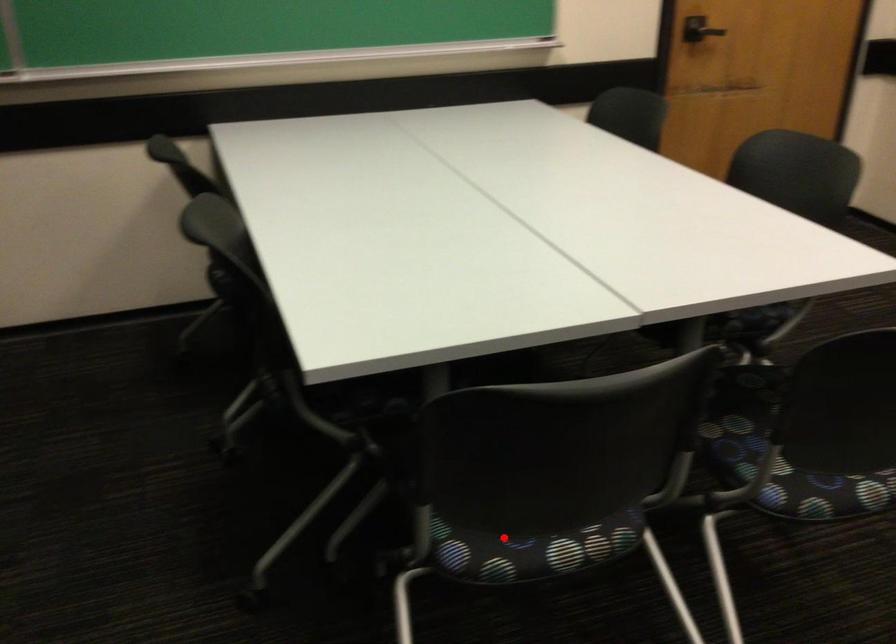
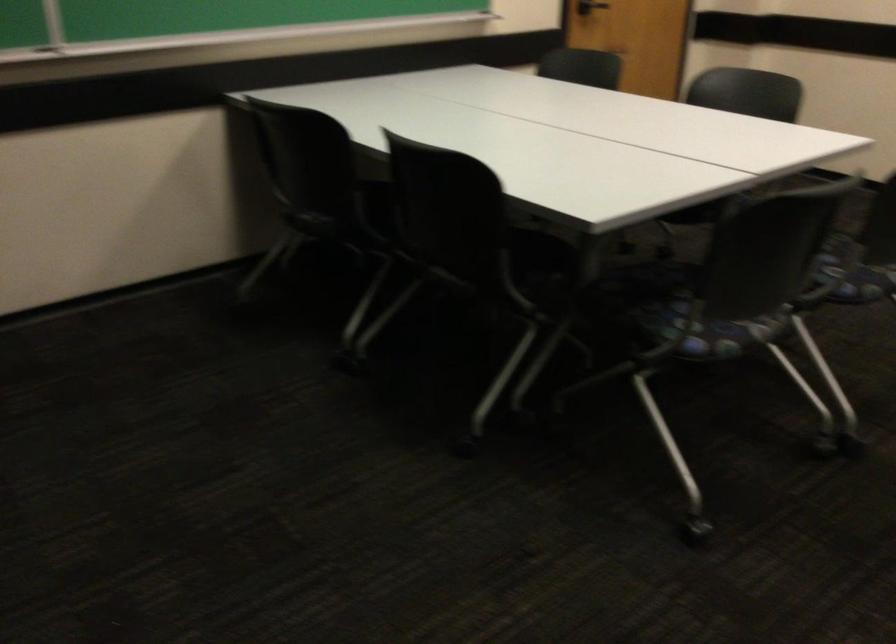
Question: I am providing you with two images of the same scene from different viewpoints. In image1, a red point is highlighted. Considering the same 3D point in image2, which of the following is correct?

Choices:
 (A) It is closer
 (B) It is farther

Answer: (B)